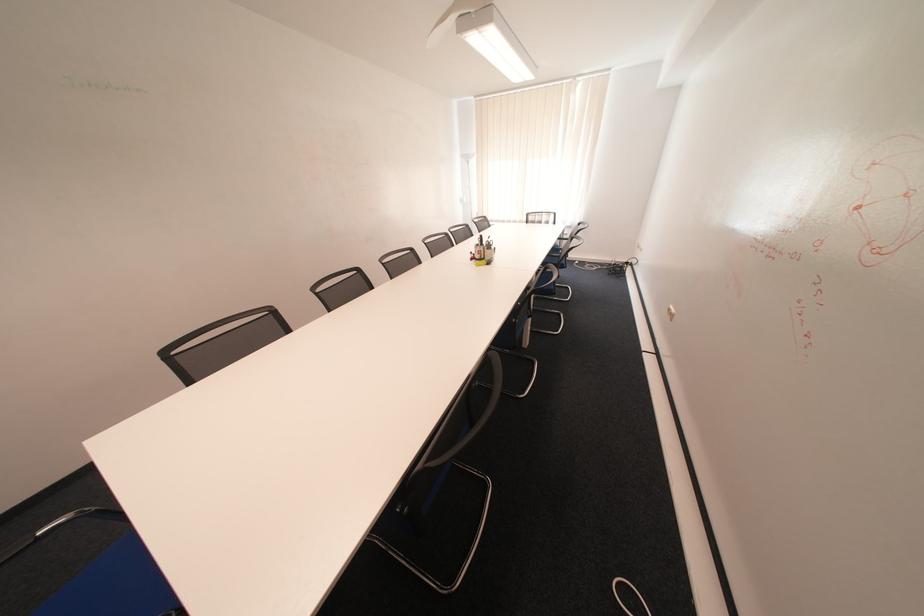
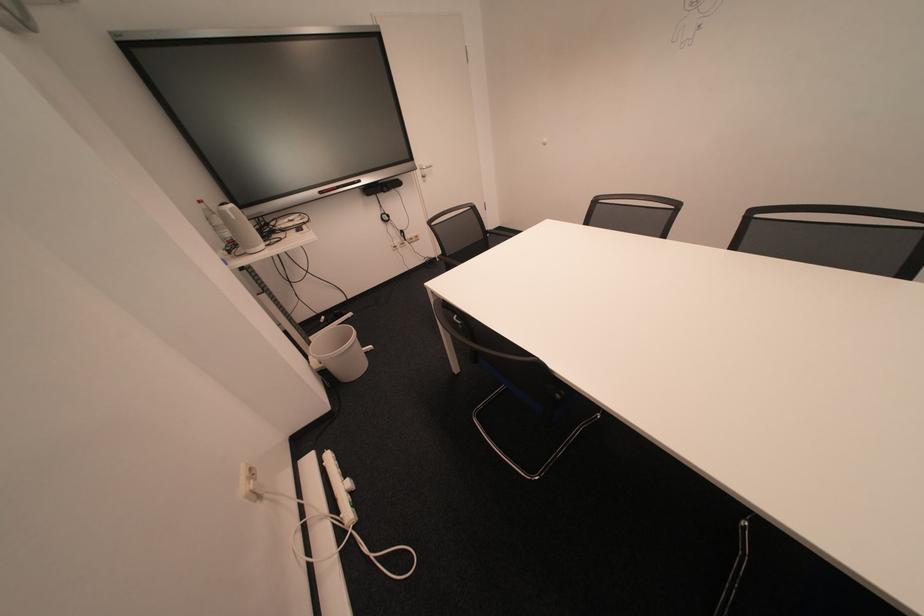
Consider the image. How did the camera likely rotate?

The camera rotated toward left-down.